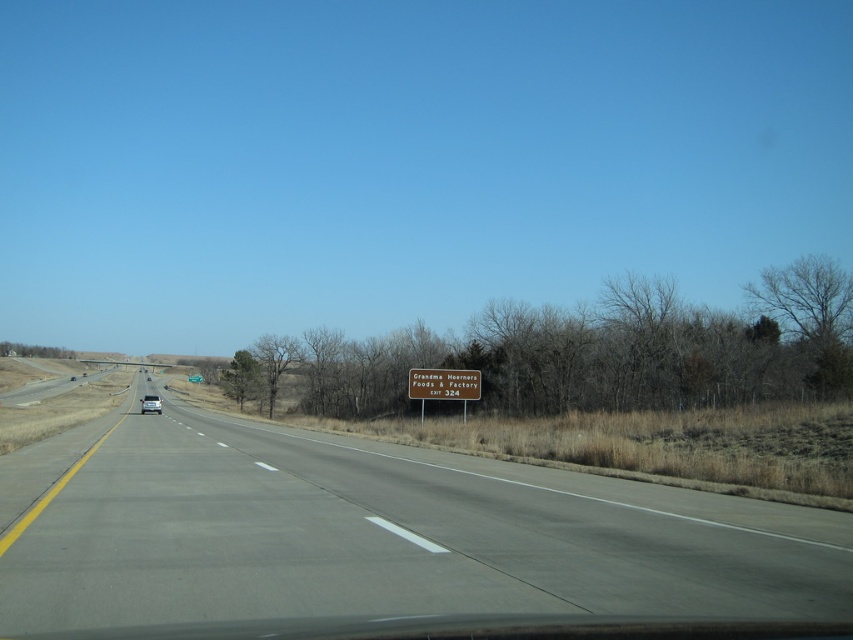
Question: Estimate the real-world distances between objects in this image. Which object is closer to the brown sign at center?

Choices:
 (A) white glossy car at center
 (B) brown wooden sign at center

Answer: (B)

Question: Is brown wooden sign at center positioned in front of white glossy car at center?

Choices:
 (A) no
 (B) yes

Answer: (B)

Question: Which object is positioned farthest from the brown sign at center?

Choices:
 (A) white glossy car at center
 (B) brown wooden sign at center

Answer: (A)

Question: Is brown sign at center below white glossy car at center?

Choices:
 (A) yes
 (B) no

Answer: (B)

Question: Which of these objects is positioned closest to the brown sign at center?

Choices:
 (A) white glossy car at center
 (B) brown wooden sign at center

Answer: (B)

Question: Is brown sign at center bigger than brown wooden sign at center?

Choices:
 (A) yes
 (B) no

Answer: (A)